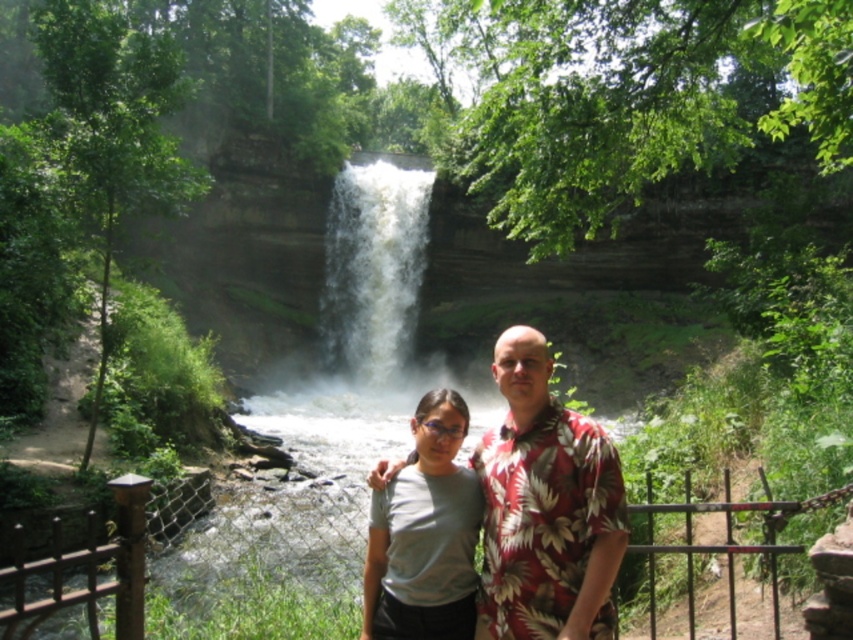
Which is behind, point (560, 577) or point (387, 348)?

Point (387, 348)

Can you confirm if floral print shirt at center is positioned above white frothy water at center?

No.

Locate an element on the screen. Image resolution: width=853 pixels, height=640 pixels. floral print shirt at center is located at coordinates (544, 508).

Describe the element at coordinates (544, 508) in the screenshot. I see `floral print shirt at center` at that location.

The width and height of the screenshot is (853, 640). Describe the element at coordinates (544, 508) in the screenshot. I see `floral print shirt at center` at that location.

This screenshot has height=640, width=853. I want to click on floral print shirt at center, so click(544, 508).

Between point (421, 452) and point (404, 324), which one is positioned behind?

The point (404, 324) is more distant.

Based on the photo, who is positioned more to the left, gray matte t-shirt at center or white frothy water at center?

Positioned to the left is white frothy water at center.

Is point (432, 440) less distant than point (415, 198)?

That is True.

Where is `gray matte t-shirt at center`? The height and width of the screenshot is (640, 853). gray matte t-shirt at center is located at coordinates (425, 534).